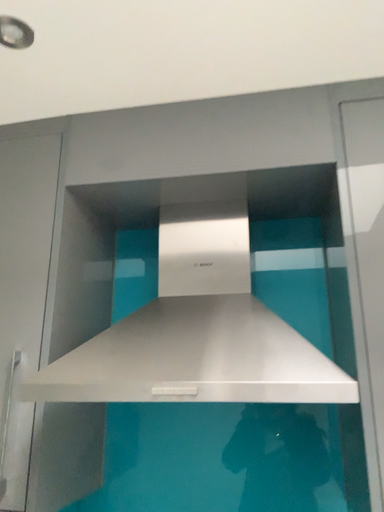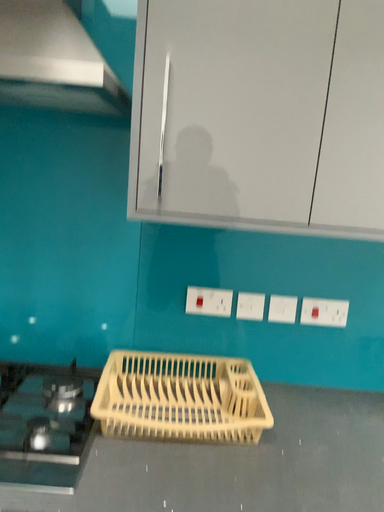
Question: How did the camera likely rotate when shooting the video?

Choices:
 (A) rotated right
 (B) rotated left

Answer: (A)